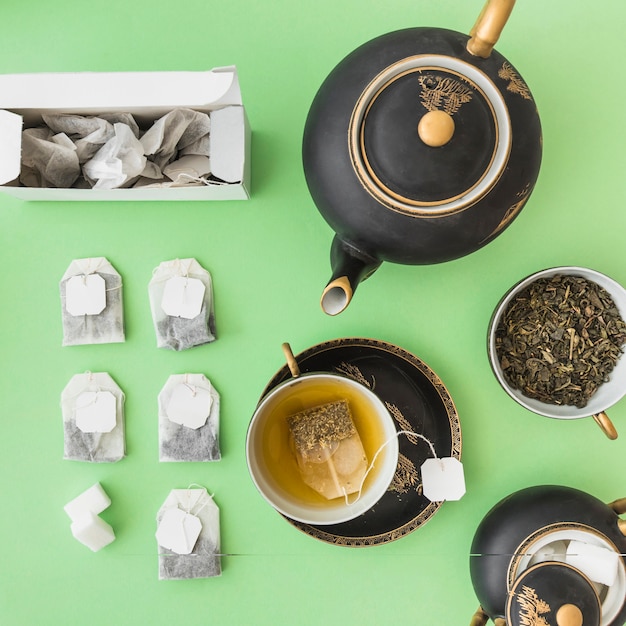
You are a GUI agent. You are given a task and a screenshot of the screen. Output one action in this format:
    pyautogui.click(x=<x>, y=<y>)
    Task: Click on the teacup
    This screenshot has height=626, width=626.
    Given the screenshot: What is the action you would take?
    pyautogui.click(x=294, y=516)